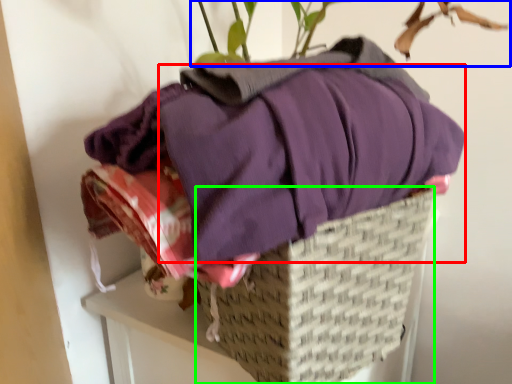
Question: Which object is the closest to the clothing (highlighted by a red box)? Choose among these: houseplant (highlighted by a blue box) or basket (highlighted by a green box).

Choices:
 (A) houseplant
 (B) basket

Answer: (B)